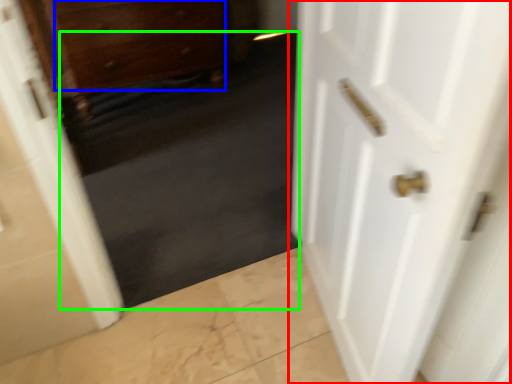
Question: Based on their relative distances, which object is farther from door (highlighted by a red box)? Choose from drawer (highlighted by a blue box) and dark (highlighted by a green box).

Choices:
 (A) drawer
 (B) dark

Answer: (A)